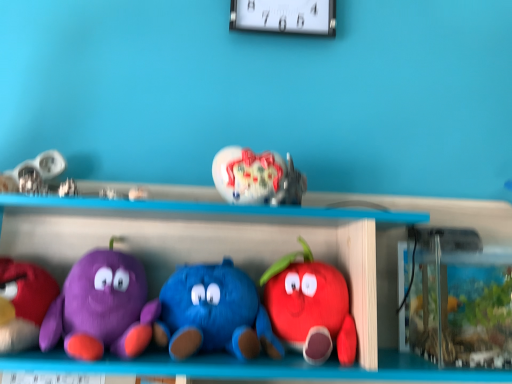
Question: Is matte plush apple at center, the 6th toy from the left, oriented away from matte purple plush at left, marked as the 2th toy in a left-to-right arrangement?

Choices:
 (A) no
 (B) yes

Answer: (A)

Question: Considering the relative sizes of matte plush apple at center, the 6th toy from the left, and matte purple plush at left, which is counted as the 5th toy, starting from the right, in the image provided, is matte plush apple at center, the 6th toy from the left, thinner than matte purple plush at left, which is counted as the 5th toy, starting from the right,?

Choices:
 (A) no
 (B) yes

Answer: (B)

Question: Is matte plush apple at center, the first toy when ordered from right to left, not near matte purple plush at left, marked as the 2th toy in a left-to-right arrangement?

Choices:
 (A) no
 (B) yes

Answer: (A)

Question: Can you confirm if matte plush apple at center, the first toy when ordered from right to left, is positioned to the right of matte purple plush at left, which is counted as the 5th toy, starting from the right?

Choices:
 (A) no
 (B) yes

Answer: (B)

Question: Considering the relative positions of matte plush apple at center, the 6th toy from the left, and matte purple plush at left, marked as the 2th toy in a left-to-right arrangement, in the image provided, is matte plush apple at center, the 6th toy from the left, to the left of matte purple plush at left, marked as the 2th toy in a left-to-right arrangement, from the viewer's perspective?

Choices:
 (A) no
 (B) yes

Answer: (A)

Question: Considering the positions of white plastic clock at upper center and matte plush apple at center, the 6th toy from the left, in the image, is white plastic clock at upper center taller or shorter than matte plush apple at center, the 6th toy from the left,?

Choices:
 (A) tall
 (B) short

Answer: (A)

Question: Is point (246, 23) positioned closer to the camera than point (316, 279)?

Choices:
 (A) closer
 (B) farther

Answer: (B)

Question: From a real-world perspective, is white plastic clock at upper center above or below matte plush apple at center, the first toy when ordered from right to left?

Choices:
 (A) below
 (B) above

Answer: (B)

Question: In terms of width, does white plastic clock at upper center look wider or thinner when compared to matte plush apple at center, the 6th toy from the left?

Choices:
 (A) thin
 (B) wide

Answer: (A)

Question: Is point (41, 324) positioned closer to the camera than point (309, 304)?

Choices:
 (A) closer
 (B) farther

Answer: (A)

Question: Is matte purple plush at left, marked as the 2th toy in a left-to-right arrangement, situated inside matte plush apple at center, the 6th toy from the left, or outside?

Choices:
 (A) outside
 (B) inside

Answer: (A)

Question: From the image's perspective, is matte purple plush at left, which is counted as the 5th toy, starting from the right, positioned above or below matte plush apple at center, the first toy when ordered from right to left?

Choices:
 (A) above
 (B) below

Answer: (A)

Question: From their relative heights in the image, would you say matte purple plush at left, marked as the 2th toy in a left-to-right arrangement, is taller or shorter than matte plush apple at center, the first toy when ordered from right to left?

Choices:
 (A) short
 (B) tall

Answer: (A)

Question: From a real-world perspective, is white plastic clock at upper center positioned above or below blue plush toy at center, which ranks as the fourth toy in left-to-right order?

Choices:
 (A) below
 (B) above

Answer: (B)

Question: Looking at their shapes, would you say white plastic clock at upper center is wider or thinner than blue plush toy at center, marked as the third toy in a right-to-left arrangement?

Choices:
 (A) wide
 (B) thin

Answer: (B)